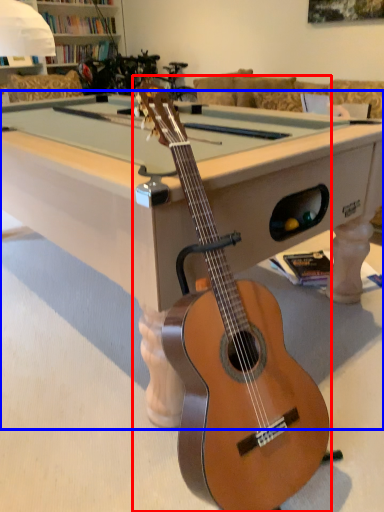
Question: Which object is closer to the camera taking this photo, guitar (highlighted by a red box) or billiard table (highlighted by a blue box)?

Choices:
 (A) guitar
 (B) billiard table

Answer: (A)